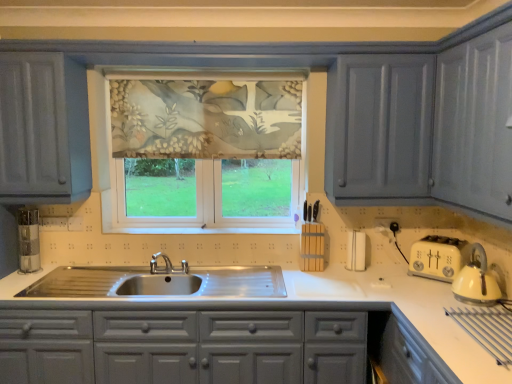
What do you see at coordinates (318, 306) in the screenshot? I see `white glossy countertop at center` at bounding box center [318, 306].

The height and width of the screenshot is (384, 512). Find the location of `white glossy countertop at center`. white glossy countertop at center is located at coordinates (318, 306).

Describe the element at coordinates (205, 153) in the screenshot. I see `floral fabric window at center` at that location.

This screenshot has width=512, height=384. I want to click on floral fabric window at center, so click(x=205, y=153).

Identify the location of white glossy countertop at center. (318, 306).

Between floral fabric window at center and white glossy countertop at center, which one appears on the right side from the viewer's perspective?

Positioned to the right is floral fabric window at center.

Considering their positions, is floral fabric window at center located in front of or behind white glossy countertop at center?

Visually, floral fabric window at center is located behind white glossy countertop at center.

Which is closer, (228, 219) or (323, 275)?

Point (323, 275)

From the image's perspective, which is above, floral fabric window at center or white glossy countertop at center?

floral fabric window at center is shown above in the image.

From a real-world perspective, which is physically above, floral fabric window at center or white glossy countertop at center?

In real-world perspective, floral fabric window at center is above.

Which object is thinner, floral fabric window at center or white glossy countertop at center?

floral fabric window at center is thinner.

Considering the relative sizes of floral fabric window at center and white glossy countertop at center in the image provided, is floral fabric window at center taller than white glossy countertop at center?

Yes.

Consider the image. Is floral fabric window at center smaller than white glossy countertop at center?

Yes.

Is floral fabric window at center inside the boundaries of white glossy countertop at center, or outside?

floral fabric window at center is not enclosed by white glossy countertop at center.

Is floral fabric window at center placed right next to white glossy countertop at center?

No, floral fabric window at center is not in contact with white glossy countertop at center.

Could you tell me if floral fabric window at center is turned towards white glossy countertop at center?

No, floral fabric window at center is not oriented towards white glossy countertop at center.

This screenshot has width=512, height=384. In the image, there is a white glossy countertop at center. In order to click on window above it (from the image's perspective) in this screenshot , I will do `click(205, 153)`.

Considering the positions of objects white glossy countertop at center and floral fabric window at center in the image provided, who is more to the left, white glossy countertop at center or floral fabric window at center?

white glossy countertop at center.

Is the depth of white glossy countertop at center greater than that of floral fabric window at center?

No, white glossy countertop at center is in front of floral fabric window at center.

Which is nearer, (476, 367) or (125, 89)?

Positioned in front is point (476, 367).

From the image's perspective, is white glossy countertop at center located above or below floral fabric window at center?

white glossy countertop at center is situated lower than floral fabric window at center in the image.

From a real-world perspective, is white glossy countertop at center physically above floral fabric window at center?

Actually, white glossy countertop at center is physically below floral fabric window at center in the real world.

Based on the photo, can you confirm if white glossy countertop at center is thinner than floral fabric window at center?

No, white glossy countertop at center is not thinner than floral fabric window at center.

From their relative heights in the image, would you say white glossy countertop at center is taller or shorter than floral fabric window at center?

white glossy countertop at center is shorter than floral fabric window at center.

Can you confirm if white glossy countertop at center is smaller than floral fabric window at center?

Actually, white glossy countertop at center might be larger than floral fabric window at center.

Is white glossy countertop at center not inside floral fabric window at center?

Yes.

Is white glossy countertop at center in contact with floral fabric window at center?

No, white glossy countertop at center is not touching floral fabric window at center.

Is white glossy countertop at center turned away from floral fabric window at center?

No.

How different are the orientations of white glossy countertop at center and floral fabric window at center in degrees?

white glossy countertop at center and floral fabric window at center are facing 0.00323 degrees away from each other.

This screenshot has height=384, width=512. I want to click on countertop directly beneath the floral fabric window at center (from a real-world perspective), so [x=318, y=306].

This screenshot has width=512, height=384. I want to click on window above the white glossy countertop at center (from the image's perspective), so click(205, 153).

Locate an element on the screen. This screenshot has width=512, height=384. countertop on the left of the floral fabric window at center is located at coordinates (318, 306).